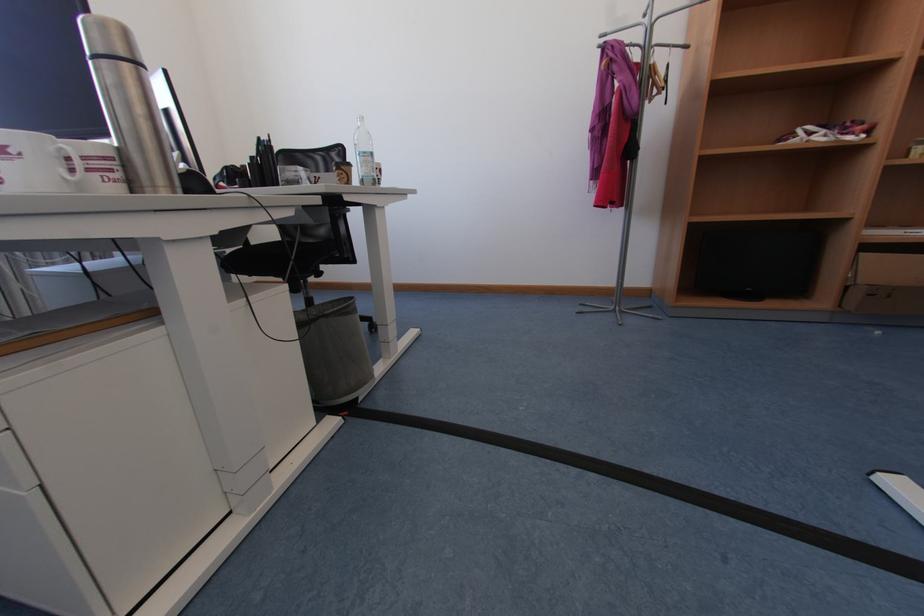
Where is `small brown jar`? The width and height of the screenshot is (924, 616). small brown jar is located at coordinates (334, 351).